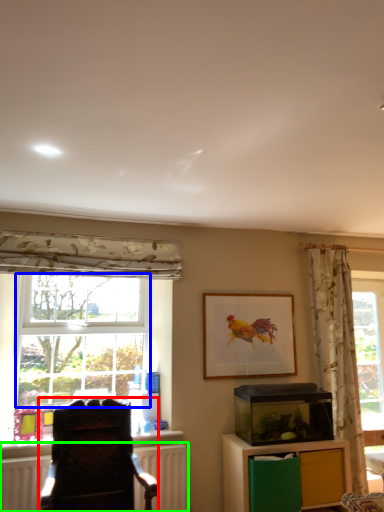
Question: Estimate the real-world distances between objects in this image. Which object is farther from furniture (highlighted by a red box), bay window (highlighted by a blue box) or radiator (highlighted by a green box)?

Choices:
 (A) bay window
 (B) radiator

Answer: (A)